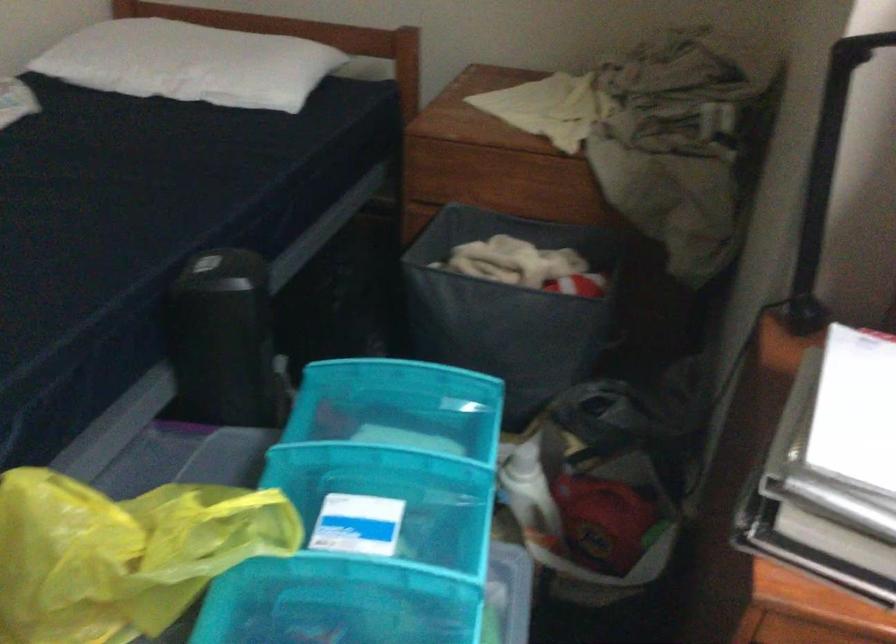
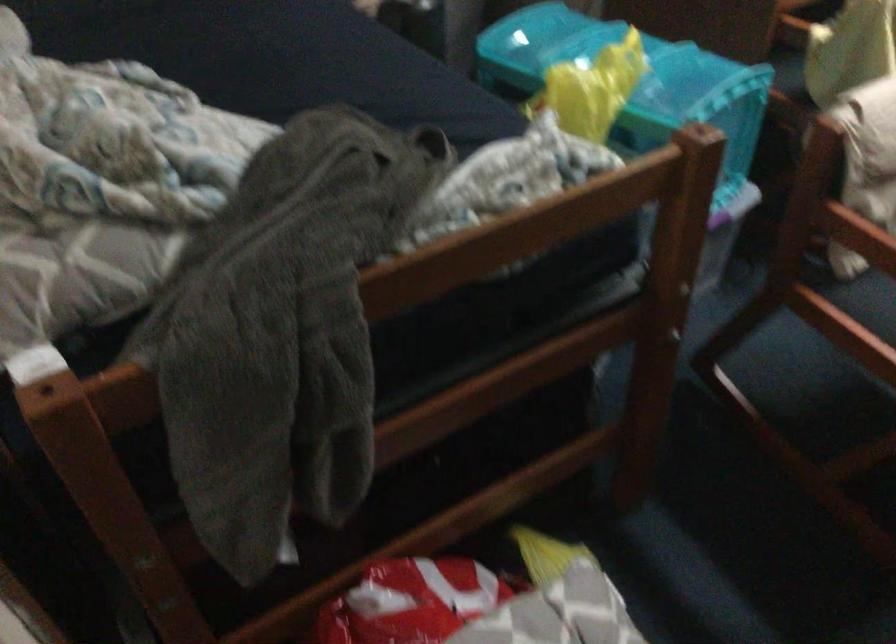
In the second image, find the point that corresponds to the point at 197,504 in the first image.

(600, 62)